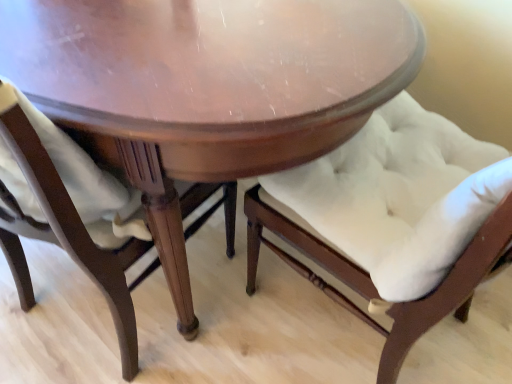
Question: From a real-world perspective, does shiny wood table at center stand above white tufted cushion at center, arranged as the second chair when viewed from the left?

Choices:
 (A) no
 (B) yes

Answer: (A)

Question: From the image's perspective, is shiny wood table at center on white tufted cushion at center, the 1th chair viewed from the right?

Choices:
 (A) no
 (B) yes

Answer: (B)

Question: Does shiny wood table at center appear on the right side of white tufted cushion at center, the 1th chair viewed from the right?

Choices:
 (A) no
 (B) yes

Answer: (A)

Question: From a real-world perspective, is shiny wood table at center beneath white tufted cushion at center, the 1th chair viewed from the right?

Choices:
 (A) yes
 (B) no

Answer: (A)

Question: Considering the relative positions of shiny wood table at center and white tufted cushion at center, the 1th chair viewed from the right, in the image provided, is shiny wood table at center in front of white tufted cushion at center, the 1th chair viewed from the right,?

Choices:
 (A) yes
 (B) no

Answer: (B)

Question: Considering the relative positions of white tufted cushion at center, the 1th chair viewed from the right, and shiny wood table at center in the image provided, is white tufted cushion at center, the 1th chair viewed from the right, to the left or to the right of shiny wood table at center?

Choices:
 (A) left
 (B) right

Answer: (B)

Question: In terms of width, does white tufted cushion at center, arranged as the second chair when viewed from the left, look wider or thinner when compared to shiny wood table at center?

Choices:
 (A) wide
 (B) thin

Answer: (B)

Question: Considering the positions of white tufted cushion at center, the 1th chair viewed from the right, and shiny wood table at center in the image, is white tufted cushion at center, the 1th chair viewed from the right, taller or shorter than shiny wood table at center?

Choices:
 (A) short
 (B) tall

Answer: (B)

Question: From a real-world perspective, is white tufted cushion at center, the 1th chair viewed from the right, positioned above or below shiny wood table at center?

Choices:
 (A) above
 (B) below

Answer: (A)

Question: In terms of height, does shiny wood table at center look taller or shorter compared to white tufted cushion at center, arranged as the second chair when viewed from the left?

Choices:
 (A) short
 (B) tall

Answer: (A)

Question: Is shiny wood table at center wider or thinner than white tufted cushion at center, the 1th chair viewed from the right?

Choices:
 (A) wide
 (B) thin

Answer: (A)

Question: Does point (121, 26) appear closer or farther from the camera than point (287, 243)?

Choices:
 (A) closer
 (B) farther

Answer: (A)

Question: From a real-world perspective, relative to white tufted cushion at center, the 1th chair viewed from the right, is shiny wood table at center vertically above or below?

Choices:
 (A) above
 (B) below

Answer: (B)

Question: Is point (117, 192) positioned closer to the camera than point (272, 104)?

Choices:
 (A) closer
 (B) farther

Answer: (B)

Question: In the image, is satin white cushion at lower left, which appears as the first chair when viewed from the left, on the left side or the right side of shiny wood table at center?

Choices:
 (A) right
 (B) left

Answer: (A)